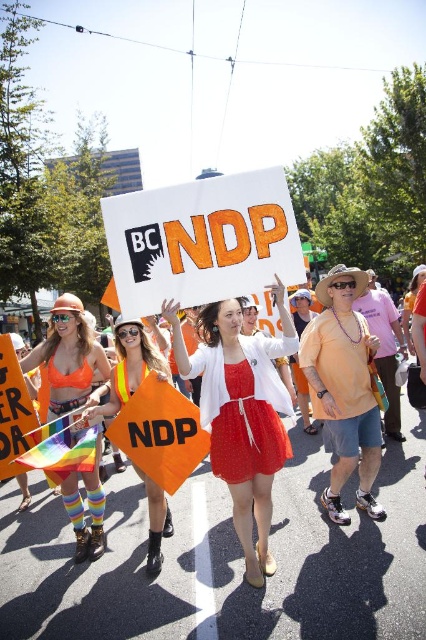
You are a photographer at the rally and want to capture a photo that includes both the matte white dress at center and the neon orange fabric at center. Which object should you place on the left side of your frame to ensure both are visible?

To include both the matte white dress at center and the neon orange fabric at center in your photo, position the neon orange fabric at center on the left side of your frame. Since the matte white dress at center is already on the right side of the neon orange fabric at center, this arrangement will ensure both are visible.